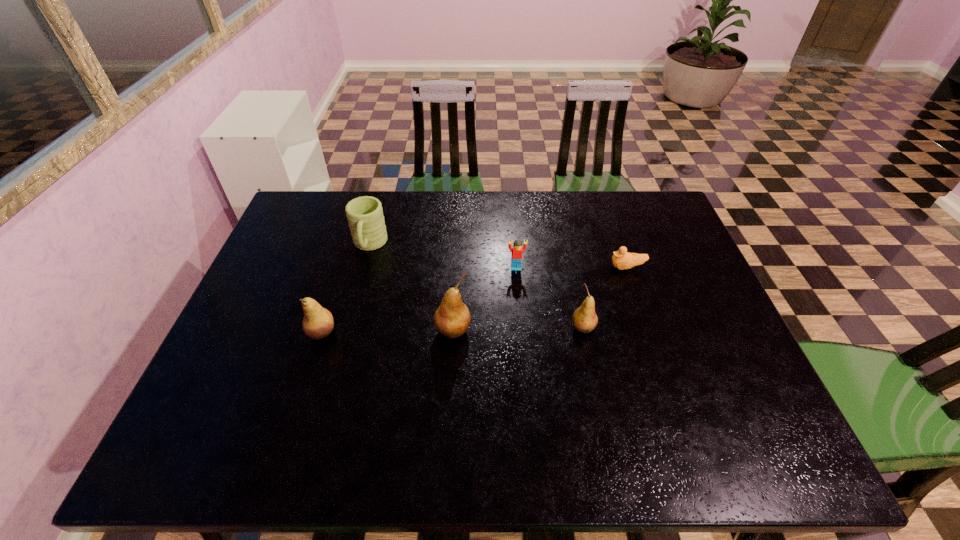
In order to click on the leftmost pear in this screenshot , I will do `click(318, 322)`.

Locate an element on the screen. Image resolution: width=960 pixels, height=540 pixels. the fifth shortest object is located at coordinates (318, 322).

Where is `the third object from left to right`? The height and width of the screenshot is (540, 960). the third object from left to right is located at coordinates (452, 319).

Locate an element on the screen. The height and width of the screenshot is (540, 960). the shortest pear is located at coordinates (584, 319).

You are a GUI agent. You are given a task and a screenshot of the screen. Output one action in this format:
    pyautogui.click(x=<x>, y=<y>)
    Task: Click on the rightmost pear
    
    Given the screenshot: What is the action you would take?
    pyautogui.click(x=584, y=319)

Locate an element on the screen. The image size is (960, 540). mug is located at coordinates (365, 216).

Locate an element on the screen. the fifth tallest object is located at coordinates (517, 249).

The height and width of the screenshot is (540, 960). Find the location of `the third object from right to left`. the third object from right to left is located at coordinates (517, 249).

Locate an element on the screen. The image size is (960, 540). duckling is located at coordinates (621, 259).

The image size is (960, 540). Identify the location of the rightmost object. [x=621, y=259].